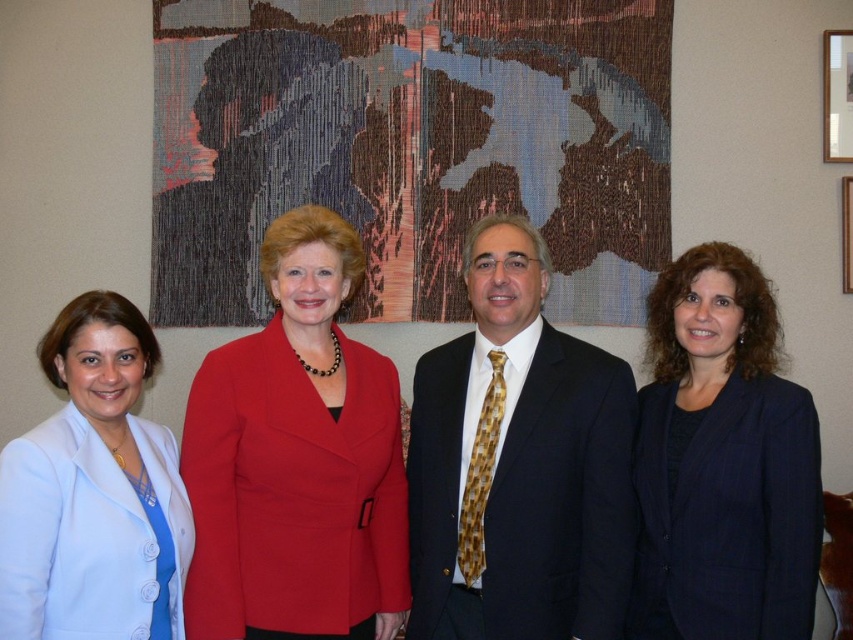
You are a photographer setting up for a group photo. You need to ensure there is enough space between the dark blue suit at right and the wooden frame at upper right for a camera dolly to move smoothly. The dolly requires at least 1.6 meters of clearance. Based on the scene description, will the current spacing between these two objects allow the dolly to move freely?

The dark blue suit at right and the wooden frame at upper right are 1.58 meters apart, which is slightly less than the required 1.6 meters clearance. Therefore, the camera dolly may not move freely without adjusting their positions to increase the distance.

You are organizing a photo shoot and need to ensure that the dark blue suit at right and the wooden frame at upper right are both visible in the final shot. Given their sizes, which object should you prioritize positioning closer to the camera to maintain clarity?

The dark blue suit at right is larger in size than the wooden frame at upper right, so you should prioritize positioning the dark blue suit at right closer to the camera to maintain clarity.